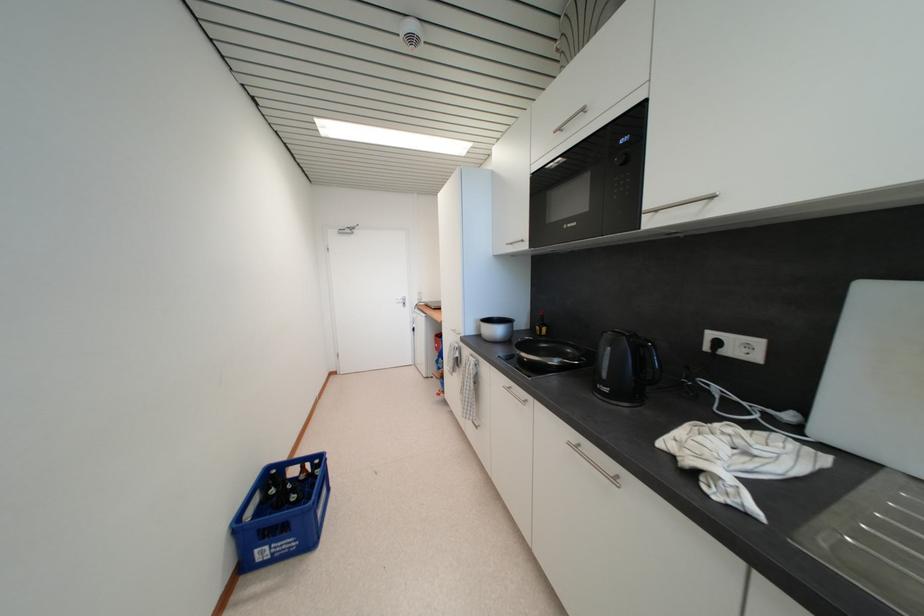
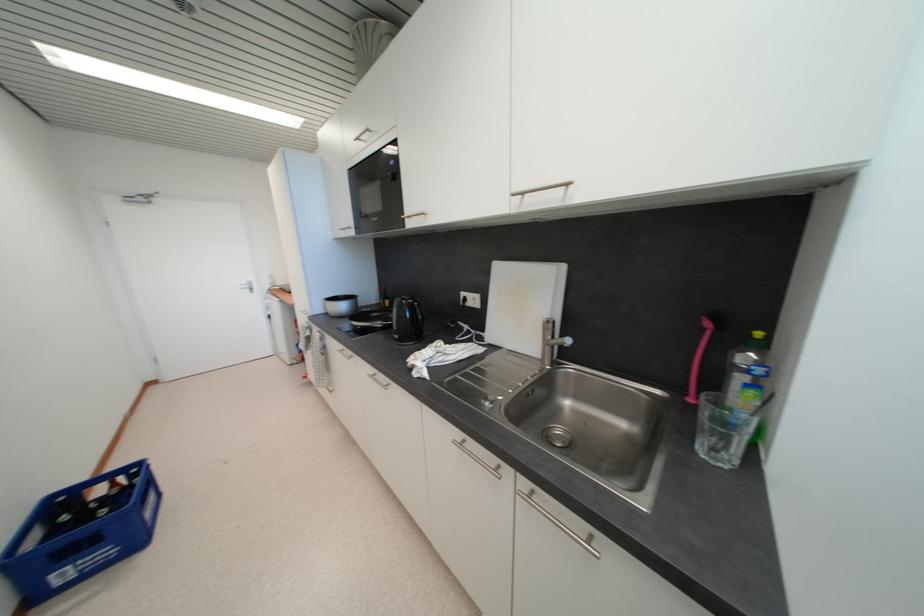
Find the pixel in the second image that matches (x=612, y=392) in the first image.

(402, 339)